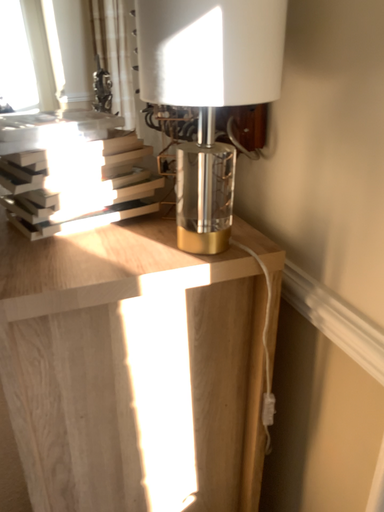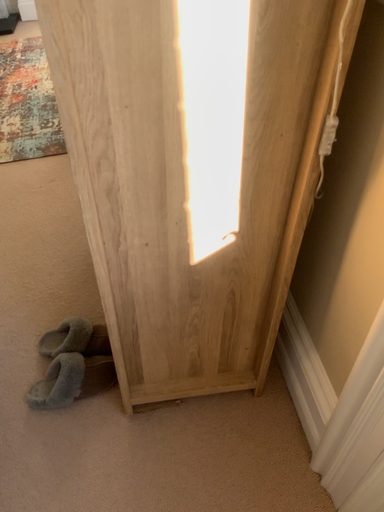
Question: How did the camera likely rotate when shooting the video?

Choices:
 (A) rotated left
 (B) rotated right

Answer: (A)